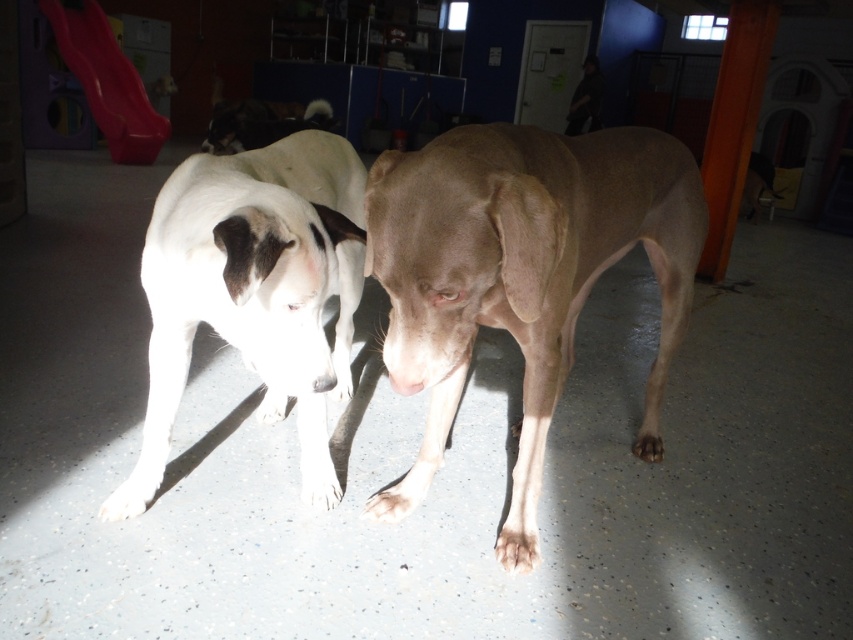
Who is higher up, smooth tan dog at center or black matte dog at center?

black matte dog at center is above.

Between point (444, 308) and point (592, 104), which one is positioned behind?

The point (592, 104) is behind.

The width and height of the screenshot is (853, 640). Describe the element at coordinates (520, 275) in the screenshot. I see `smooth tan dog at center` at that location.

Identify the location of smooth tan dog at center. (520, 275).

Can you confirm if white fur dog at upper center is smaller than black matte dog at center?

Actually, white fur dog at upper center might be larger than black matte dog at center.

Between point (329, 108) and point (583, 84), which one is positioned in front?

Point (329, 108) is in front.

Locate an element on the screen. This screenshot has width=853, height=640. white fur dog at upper center is located at coordinates (260, 125).

Can you confirm if smooth tan dog at center is bigger than white fur dog at upper center?

Incorrect, smooth tan dog at center is not larger than white fur dog at upper center.

Which of these two, smooth tan dog at center or white fur dog at upper center, stands shorter?

With less height is white fur dog at upper center.

Locate an element on the screen. This screenshot has height=640, width=853. smooth tan dog at center is located at coordinates point(520,275).